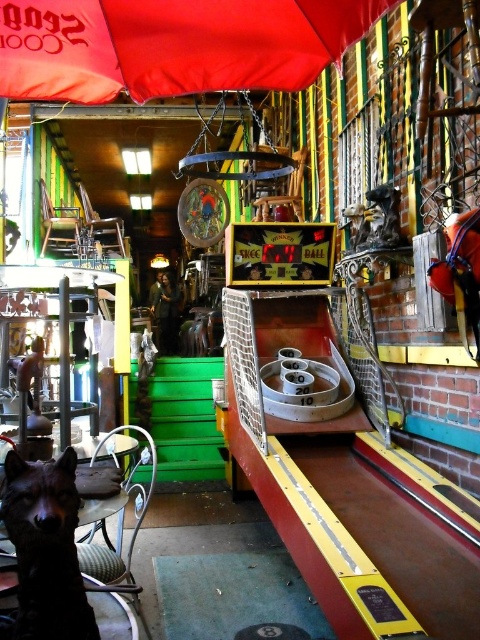
Question: Which of the following is the closest to the observer?

Choices:
 (A) black fur dog at lower left
 (B) red fabric umbrella at upper center

Answer: (A)

Question: From the image, what is the correct spatial relationship of red fabric umbrella at upper center in relation to black fur dog at lower left?

Choices:
 (A) below
 (B) above

Answer: (B)

Question: Among these points, which one is farthest from the camera?

Choices:
 (A) (265, 58)
 (B) (59, 504)

Answer: (A)

Question: Is red fabric umbrella at upper center positioned before black fur dog at lower left?

Choices:
 (A) no
 (B) yes

Answer: (A)

Question: Does red fabric umbrella at upper center have a greater width compared to black fur dog at lower left?

Choices:
 (A) yes
 (B) no

Answer: (A)

Question: Which point appears closest to the camera in this image?

Choices:
 (A) (59, 464)
 (B) (118, 49)

Answer: (A)